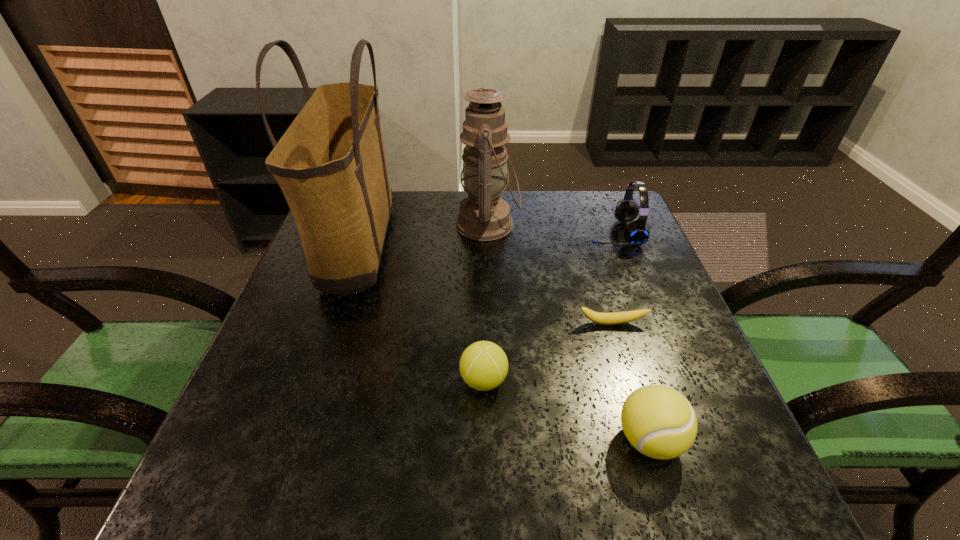
The width and height of the screenshot is (960, 540). In order to click on vacant space at the near edge of the desktop in this screenshot , I will do `click(597, 505)`.

The image size is (960, 540). I want to click on vacant space at the right edge, so click(700, 387).

The width and height of the screenshot is (960, 540). Find the location of `vacant space at the near left corner of the desktop`. vacant space at the near left corner of the desktop is located at coordinates (237, 481).

At what (x,y) coordinates should I click in order to perform the action: click on free space at the far right corner of the desktop. Please return your answer as a coordinate pair (x, y). The width and height of the screenshot is (960, 540). Looking at the image, I should click on (588, 201).

The width and height of the screenshot is (960, 540). Find the location of `vacant point located between the leftmost object and the fourth shortest object`. vacant point located between the leftmost object and the fourth shortest object is located at coordinates (486, 242).

Identify the location of vacant area that lies between the leftmost object and the fourth farthest object. This screenshot has width=960, height=540. (485, 287).

The width and height of the screenshot is (960, 540). What are the coordinates of `vacant space in between the third nearest object and the second tallest object` in the screenshot? It's located at (550, 274).

Locate an element on the screen. The width and height of the screenshot is (960, 540). free point between the third shortest object and the farther tennis ball is located at coordinates (566, 410).

Image resolution: width=960 pixels, height=540 pixels. I want to click on unoccupied position between the leftmost object and the banana, so (485, 287).

Where is `unoccupied position between the farther tennis ball and the headset`? This screenshot has height=540, width=960. unoccupied position between the farther tennis ball and the headset is located at coordinates (548, 307).